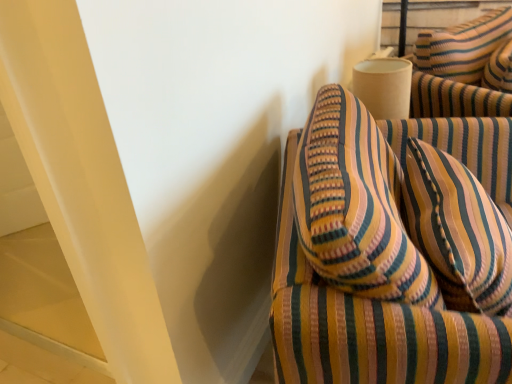
Question: Should I look upward or downward to see striped fabric pillow at right?

Choices:
 (A) up
 (B) down

Answer: (B)

Question: Considering the relative sizes of striped fabric armchair at right and striped fabric pillow at right in the image provided, is striped fabric armchair at right taller than striped fabric pillow at right?

Choices:
 (A) no
 (B) yes

Answer: (B)

Question: Is striped fabric armchair at right bigger than striped fabric pillow at right?

Choices:
 (A) yes
 (B) no

Answer: (A)

Question: From the image's perspective, is striped fabric armchair at right under striped fabric pillow at right?

Choices:
 (A) yes
 (B) no

Answer: (A)

Question: Are striped fabric armchair at right and striped fabric pillow at right far apart?

Choices:
 (A) no
 (B) yes

Answer: (A)

Question: Is the surface of striped fabric armchair at right in direct contact with striped fabric pillow at right?

Choices:
 (A) no
 (B) yes

Answer: (B)

Question: Is striped fabric armchair at right shorter than striped fabric pillow at right?

Choices:
 (A) yes
 (B) no

Answer: (B)

Question: Is striped fabric pillow at right shorter than striped fabric armchair at right?

Choices:
 (A) no
 (B) yes

Answer: (B)

Question: Is striped fabric pillow at right positioned beyond the bounds of striped fabric armchair at right?

Choices:
 (A) no
 (B) yes

Answer: (A)

Question: Is striped fabric pillow at right touching striped fabric armchair at right?

Choices:
 (A) yes
 (B) no

Answer: (A)

Question: Does striped fabric pillow at right appear on the left side of striped fabric armchair at right?

Choices:
 (A) no
 (B) yes

Answer: (A)

Question: Is striped fabric pillow at right positioned far away from striped fabric armchair at right?

Choices:
 (A) yes
 (B) no

Answer: (B)

Question: Considering the relative sizes of striped fabric pillow at right and striped fabric armchair at right in the image provided, is striped fabric pillow at right smaller than striped fabric armchair at right?

Choices:
 (A) yes
 (B) no

Answer: (A)

Question: From the image's perspective, is striped fabric armchair at right located above or below striped fabric pillow at right?

Choices:
 (A) below
 (B) above

Answer: (A)